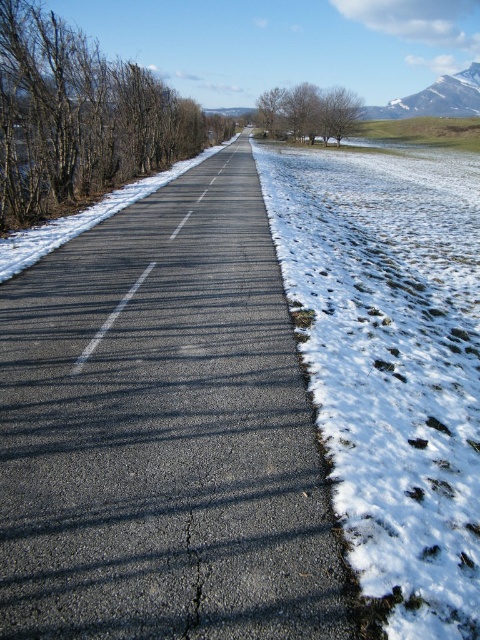
You are a hiker planning to cross the road and reach the white powdery snow at right and the snowy granite mountain at upper right. Which of these two landmarks is closer to the road?

The white powdery snow at right is closer to the road compared to the snowy granite mountain at upper right because it has a lesser height.

You are standing on the side of the road in the snowy landscape shown. You want to walk to the point marked at coordinates (x=343, y=244). How far will you have to walk to reach that point?

The point at coordinates (x=343, y=244) is 12.70 meters away from the viewer, so you will have to walk 12.70 meters to reach it.